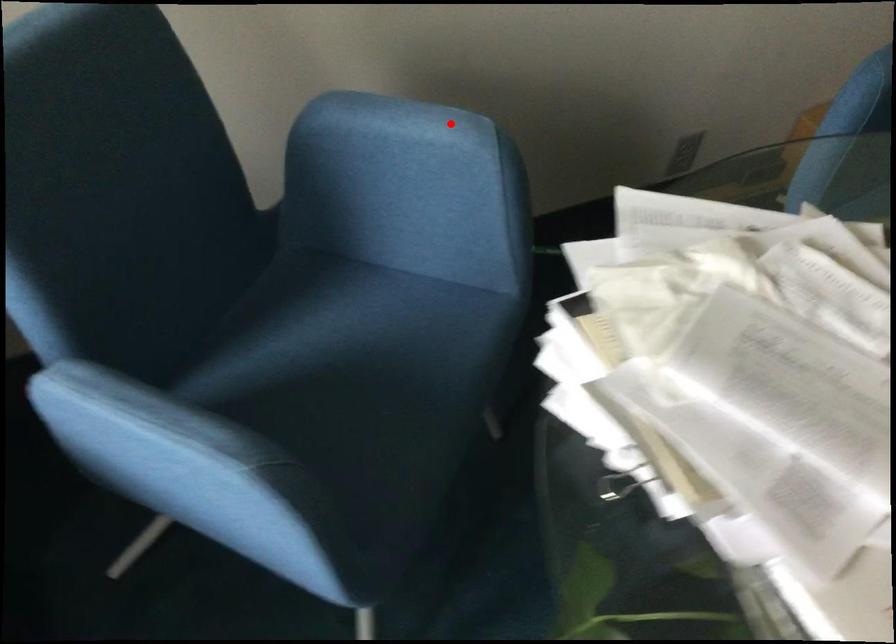
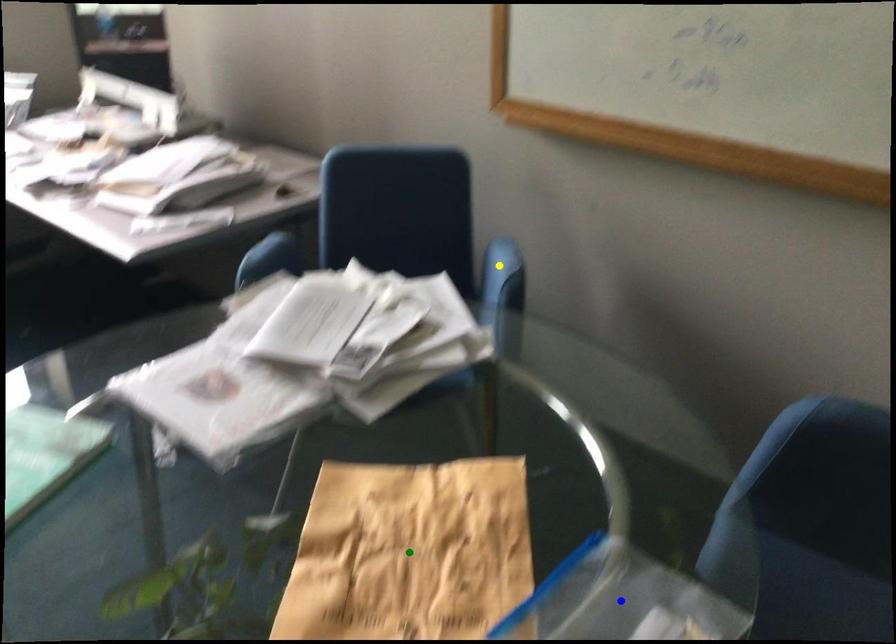
Question: I am providing you with two images of the same scene from different viewpoints. A red point is marked on the first image. You are given multiple points on the second image. Which mark in image 2 goes with the point in image 1?

Choices:
 (A) blue point
 (B) yellow point
 (C) green point

Answer: (B)